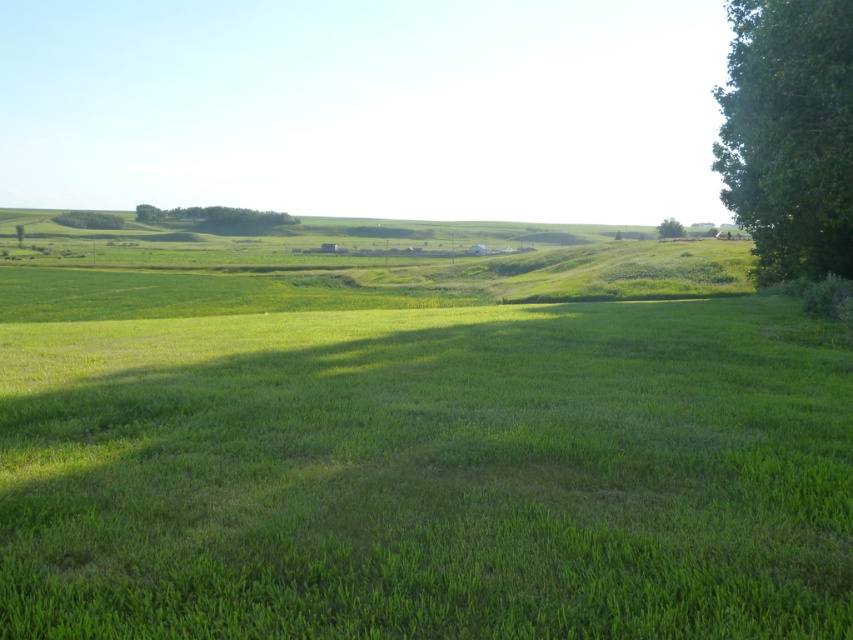
Question: Does green leafy tree at right have a greater width compared to green leafy tree at upper left?

Choices:
 (A) yes
 (B) no

Answer: (A)

Question: Considering the real-world distances, which object is farthest from the green leafy tree at right?

Choices:
 (A) green leafy tree at upper right
 (B) green leafy tree at upper left

Answer: (B)

Question: Which object is positioned farthest from the green leafy tree at upper left?

Choices:
 (A) green leafy tree at right
 (B) green leafy tree at upper right
 (C) green leafy trees at center

Answer: (A)

Question: Where is green leafy tree at upper left located in relation to green leafy tree at upper right in the image?

Choices:
 (A) left
 (B) right

Answer: (A)

Question: Which object is farther from the camera taking this photo?

Choices:
 (A) green leafy tree at upper right
 (B) green leafy tree at right
 (C) green leafy tree at upper left

Answer: (C)

Question: Can you confirm if green leafy trees at center is wider than green leafy tree at upper right?

Choices:
 (A) no
 (B) yes

Answer: (B)